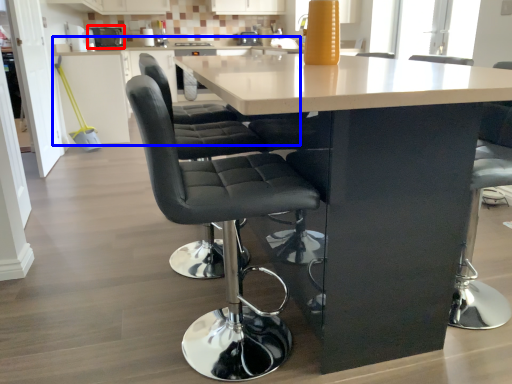
Question: Among these objects, which one is nearest to the camera, appliance (highlighted by a red box) or counter (highlighted by a blue box)?

Choices:
 (A) appliance
 (B) counter

Answer: (B)